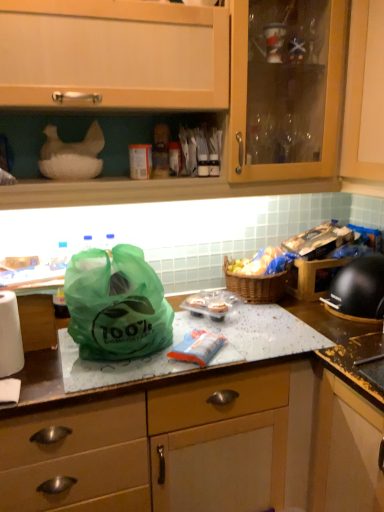
I want to click on vacant region above transparent glass countertop at center (from a real-world perspective), so click(x=241, y=329).